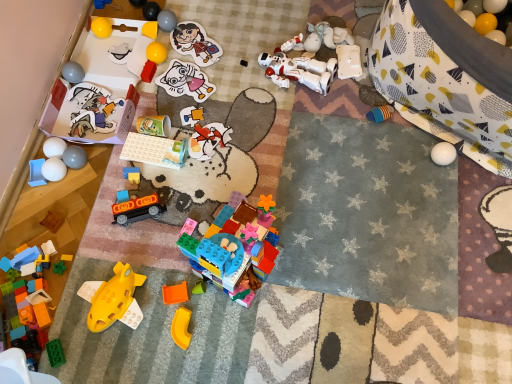
The image size is (512, 384). I want to click on vacant space behind white matte robot at upper center, the 3th toy viewed from the right, so click(x=274, y=22).